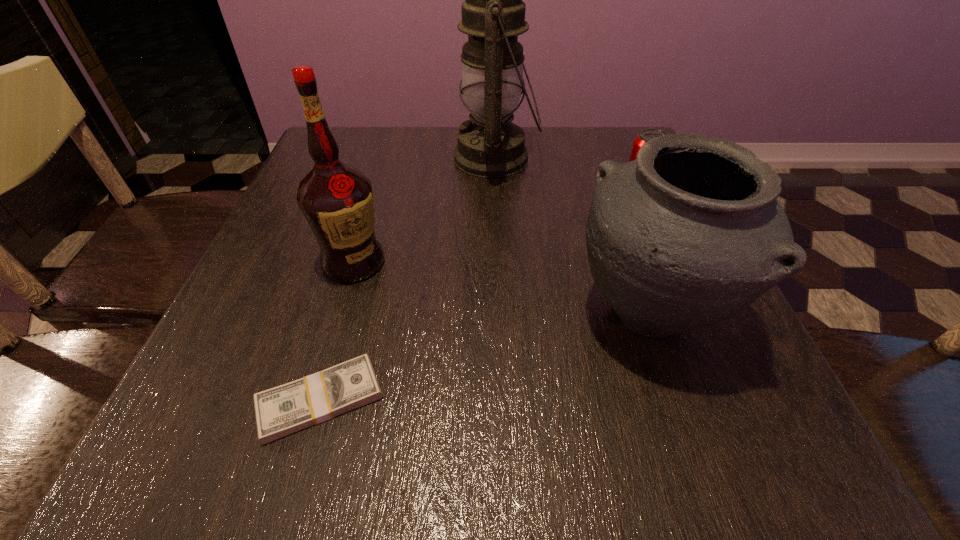
I want to click on vacant space at the near left corner, so click(157, 447).

Where is `vacant space in between the alcohol and the second shortest object`? vacant space in between the alcohol and the second shortest object is located at coordinates pos(495,230).

The image size is (960, 540). I want to click on free space between the alcohol and the urn, so click(501, 288).

Find the location of a particular element. Image resolution: width=960 pixels, height=540 pixels. free area in between the third object from right to left and the second shortest object is located at coordinates (566, 178).

Find the location of a particular element. vacant area that lies between the dollar and the can is located at coordinates (479, 299).

Locate an element on the screen. This screenshot has height=540, width=960. unoccupied position between the dollar and the urn is located at coordinates (484, 357).

You are a GUI agent. You are given a task and a screenshot of the screen. Output one action in this format:
    pyautogui.click(x=<x>, y=<y>)
    Task: Click on the free area in between the second shortest object and the shortest object
    
    Given the screenshot: What is the action you would take?
    pyautogui.click(x=479, y=299)

The image size is (960, 540). Find the location of `unoccupied area between the third shortest object and the oil lamp`. unoccupied area between the third shortest object and the oil lamp is located at coordinates (571, 237).

Locate an element on the screen. This screenshot has width=960, height=540. free space between the second tallest object and the third tallest object is located at coordinates (501, 288).

Where is `free spot between the oil lamp and the urn`? The image size is (960, 540). free spot between the oil lamp and the urn is located at coordinates (571, 237).